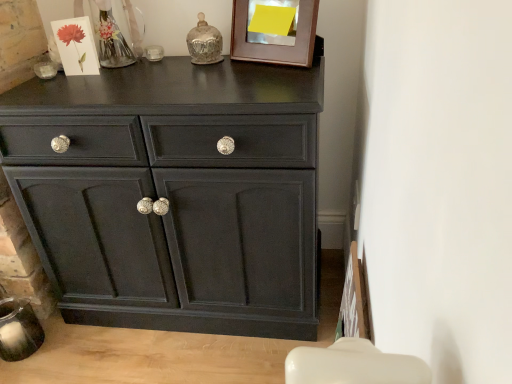
Question: Considering the relative sizes of wooden picture frame at upper center and matte black cabinet at center in the image provided, is wooden picture frame at upper center taller than matte black cabinet at center?

Choices:
 (A) no
 (B) yes

Answer: (A)

Question: Does wooden picture frame at upper center have a lesser height compared to matte black cabinet at center?

Choices:
 (A) no
 (B) yes

Answer: (B)

Question: Is wooden picture frame at upper center to the left of matte black cabinet at center from the viewer's perspective?

Choices:
 (A) yes
 (B) no

Answer: (B)

Question: From a real-world perspective, is wooden picture frame at upper center over matte black cabinet at center?

Choices:
 (A) yes
 (B) no

Answer: (A)

Question: From the image's perspective, is wooden picture frame at upper center located above matte black cabinet at center?

Choices:
 (A) no
 (B) yes

Answer: (B)

Question: Can you confirm if wooden picture frame at upper center is smaller than matte black cabinet at center?

Choices:
 (A) yes
 (B) no

Answer: (A)

Question: Does matte black cabinet at center appear on the left side of wooden picture frame at upper center?

Choices:
 (A) yes
 (B) no

Answer: (A)

Question: Is matte black cabinet at center next to wooden picture frame at upper center and touching it?

Choices:
 (A) yes
 (B) no

Answer: (B)

Question: Does matte black cabinet at center have a smaller size compared to wooden picture frame at upper center?

Choices:
 (A) no
 (B) yes

Answer: (A)

Question: Is matte black cabinet at center located outside wooden picture frame at upper center?

Choices:
 (A) no
 (B) yes

Answer: (B)

Question: From the image's perspective, would you say matte black cabinet at center is positioned over wooden picture frame at upper center?

Choices:
 (A) yes
 (B) no

Answer: (B)

Question: From the image's perspective, is matte black cabinet at center beneath wooden picture frame at upper center?

Choices:
 (A) no
 (B) yes

Answer: (B)

Question: Relative to matte black cabinet at center, is wooden picture frame at upper center in front or behind?

Choices:
 (A) behind
 (B) front

Answer: (A)